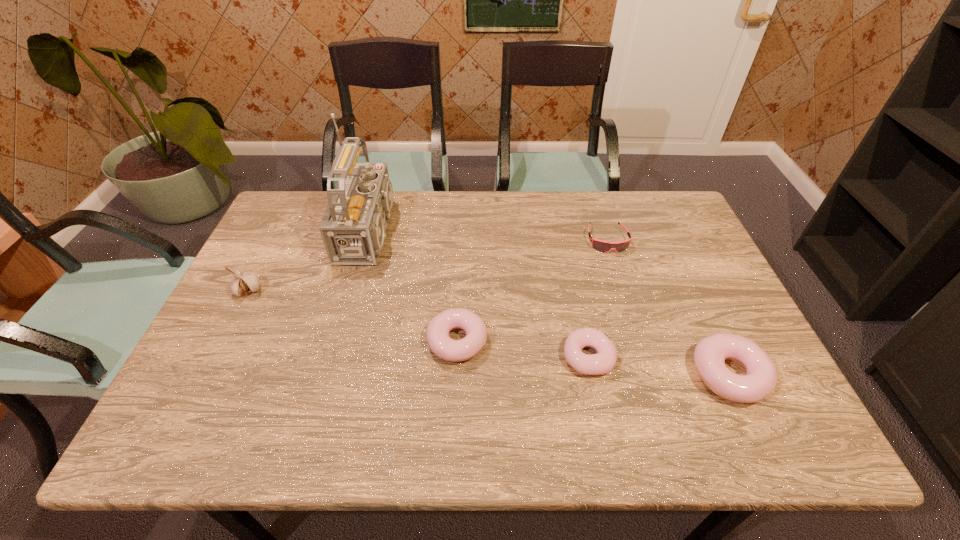
At what (x,y) coordinates should I click in order to perform the action: click on the third object from left to right. Please return your answer as a coordinate pair (x, y). Looking at the image, I should click on (438, 339).

Locate an element on the screen. the second tallest doughnut is located at coordinates (x=438, y=339).

The image size is (960, 540). In order to click on the shortest doughnut in this screenshot , I will do `click(603, 362)`.

Find the location of `the second doughnut from right to left`. the second doughnut from right to left is located at coordinates (603, 362).

I want to click on the rightmost object, so click(x=760, y=379).

Where is `the tallest object`? The width and height of the screenshot is (960, 540). the tallest object is located at coordinates (353, 227).

This screenshot has width=960, height=540. What are the coordinates of `the second object from left to right` in the screenshot? It's located at (353, 227).

Locate an element on the screen. the fifth object from left to right is located at coordinates (603, 246).

This screenshot has height=540, width=960. What are the coordinates of `the leftmost object` in the screenshot? It's located at (246, 282).

Locate an element on the screen. the second tallest object is located at coordinates (246, 282).